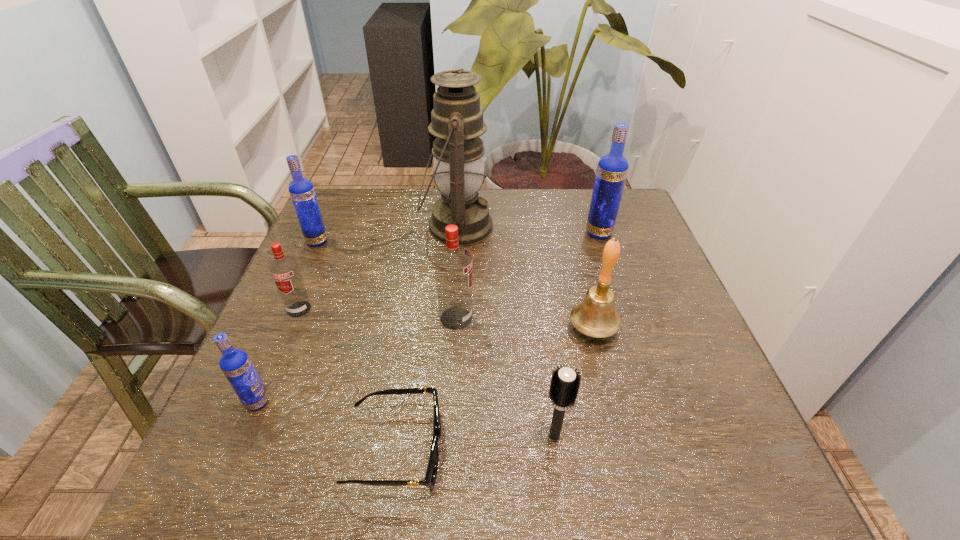
Locate an element on the screen. The height and width of the screenshot is (540, 960). free space at the near edge of the desktop is located at coordinates (320, 475).

In the image, there is a desktop. In order to click on vacant space at the left edge in this screenshot , I will do `click(349, 260)`.

In the image, there is a desktop. Find the location of `free space at the right edge`. free space at the right edge is located at coordinates (601, 241).

In order to click on vacant area at the far left corner in this screenshot , I will do `click(339, 214)`.

Where is `free area in between the right red vodka and the shortest object`? The height and width of the screenshot is (540, 960). free area in between the right red vodka and the shortest object is located at coordinates (426, 383).

Locate an element on the screen. The height and width of the screenshot is (540, 960). free spot between the left red vodka and the shortest object is located at coordinates (348, 379).

Locate an element on the screen. This screenshot has height=540, width=960. vacant space that is in between the bell and the oil lamp is located at coordinates (525, 277).

Where is `free space between the left red vodka and the second biggest blue vodka`? This screenshot has height=540, width=960. free space between the left red vodka and the second biggest blue vodka is located at coordinates (308, 275).

Image resolution: width=960 pixels, height=540 pixels. I want to click on vacant point located between the nearest vodka and the right red vodka, so click(357, 360).

I want to click on free spot between the right red vodka and the nearest blue vodka, so click(x=357, y=360).